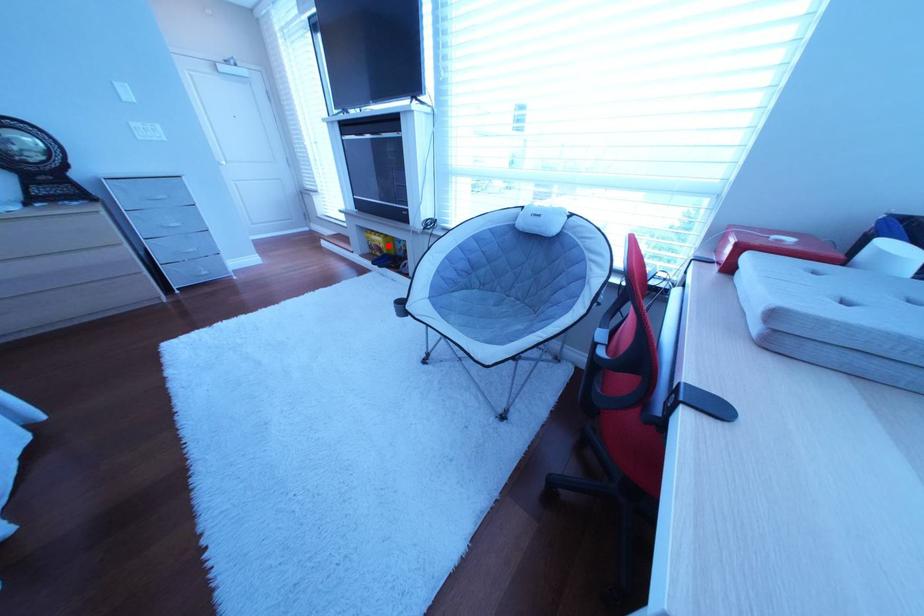
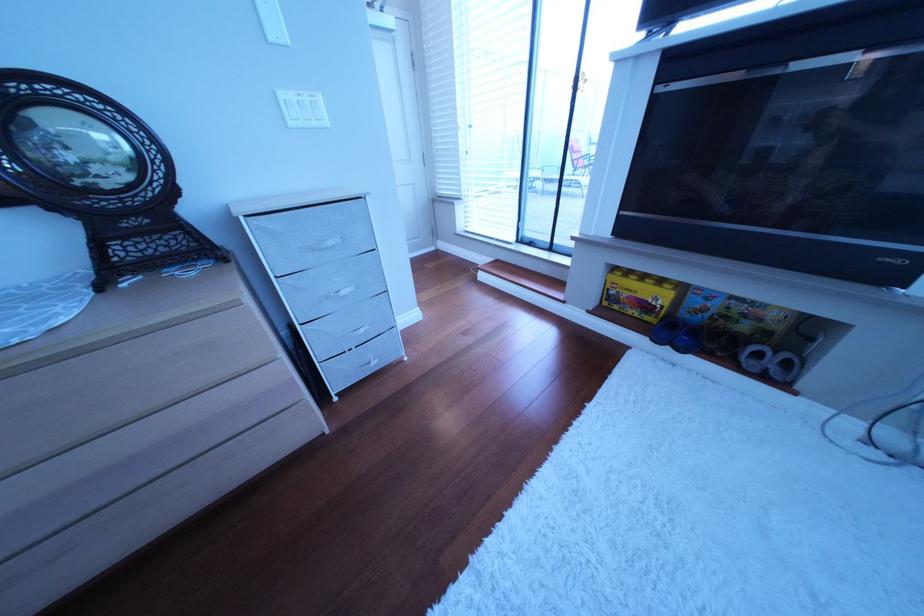
In the second image, find the point that corresponds to the highlighted location in the first image.

(640, 296)